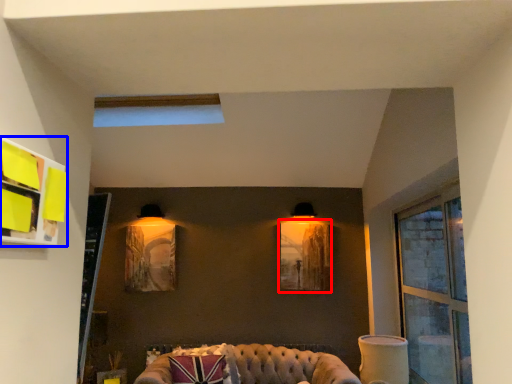
Question: Among these objects, which one is nearest to the camera, picture frame (highlighted by a red box) or shelf (highlighted by a blue box)?

Choices:
 (A) picture frame
 (B) shelf

Answer: (B)